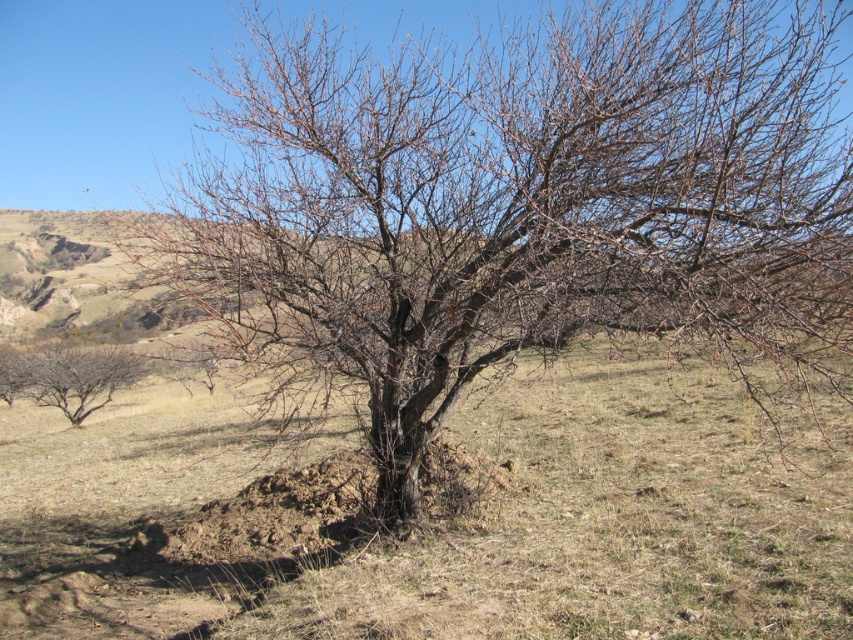
You are standing at the point marked as point (68, 376) in the image. Looking around, you notice the tree with sparse reddish branches. Which direction should you walk to reach the tree with sparse reddish branches?

The point (68, 376) corresponds to bare branches at left, so you are already at the tree with sparse reddish branches.

You are a gardener observing the tree with bare branches at left and bare branches at lower left. Which set of branches is closer to the ground?

The bare branches at lower left are closer to the ground since they are shorter than the bare branches at left.

You are standing in the rural landscape and want to walk from the bare branches at lower left to the bare branches at left. Which direction should you face to walk directly towards them?

You should face to the right because the bare branches at left are located to the right of the bare branches at lower left.